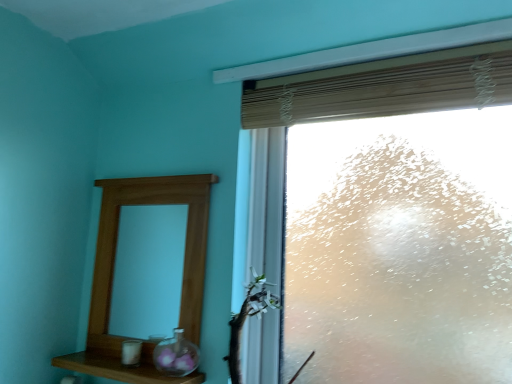
Find the location of a particular element. free spot above wooden shelf at lower left (from a real-world perspective) is located at coordinates (123, 360).